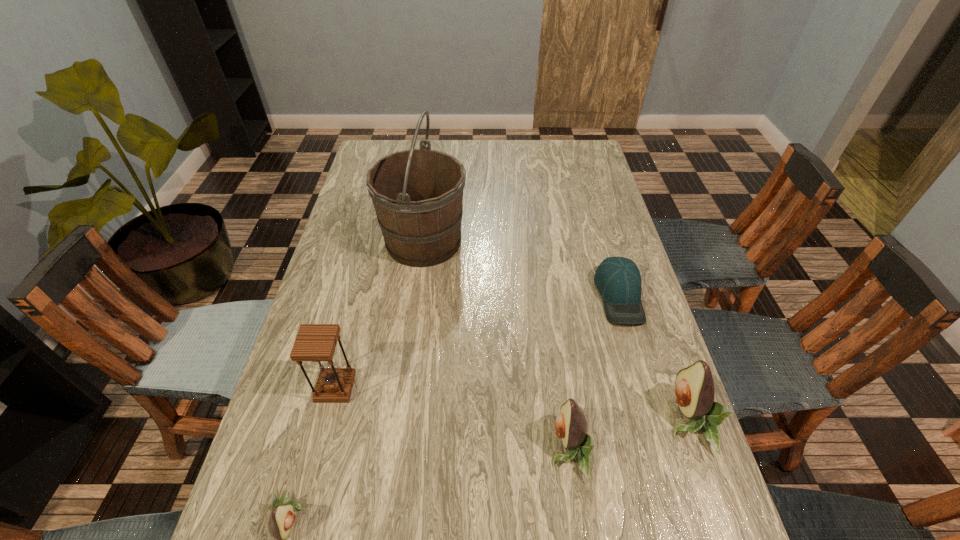
The height and width of the screenshot is (540, 960). Identify the location of vacant space located 0.150m on the seed side of the rightmost avocado. (600, 420).

Where is `blank area located 0.240m on the seed side of the rightmost avocado`? The height and width of the screenshot is (540, 960). blank area located 0.240m on the seed side of the rightmost avocado is located at coordinates (560, 420).

Find the location of a particular element. vacant space located on the right of the tallest object is located at coordinates (560, 241).

The height and width of the screenshot is (540, 960). Identify the location of free space located on the back of the baseball cap. (594, 211).

This screenshot has height=540, width=960. I want to click on vacant space situated 0.150m on the back of the hourglass, so click(352, 323).

This screenshot has width=960, height=540. In order to click on object present at the near edge in this screenshot , I will do `click(571, 426)`.

The width and height of the screenshot is (960, 540). Identify the location of bucket located in the left edge section of the desktop. (417, 194).

You are a GUI agent. You are given a task and a screenshot of the screen. Output one action in this format:
    pyautogui.click(x=<x>, y=<y>)
    Task: Click on the hourglass that is at the left edge
    
    Given the screenshot: What is the action you would take?
    pyautogui.click(x=314, y=342)

This screenshot has width=960, height=540. I want to click on avocado situated at the right edge, so (694, 388).

The width and height of the screenshot is (960, 540). Find the location of `baseball cap situated at the right edge`. baseball cap situated at the right edge is located at coordinates (618, 279).